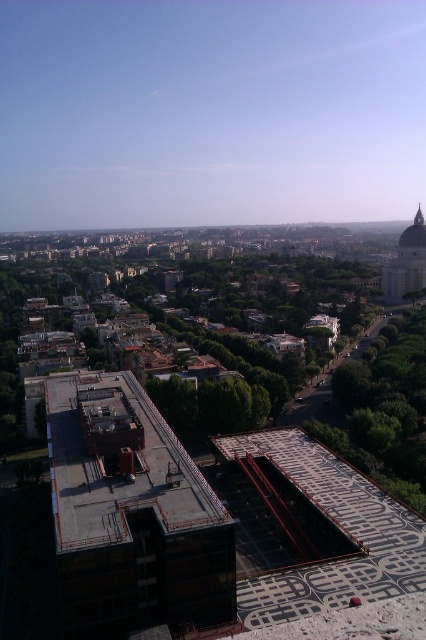
Question: Does white marble dome at upper right come in front of matte white dome at upper right?

Choices:
 (A) yes
 (B) no

Answer: (A)

Question: Which point is farther to the camera?

Choices:
 (A) pyautogui.click(x=394, y=291)
 (B) pyautogui.click(x=414, y=220)

Answer: (B)

Question: Which of the following is the closest to the observer?

Choices:
 (A) white marble dome at upper right
 (B) matte white dome at upper right

Answer: (A)

Question: Is white marble dome at upper right above matte white dome at upper right?

Choices:
 (A) no
 (B) yes

Answer: (A)

Question: Is white marble dome at upper right bigger than matte white dome at upper right?

Choices:
 (A) no
 (B) yes

Answer: (B)